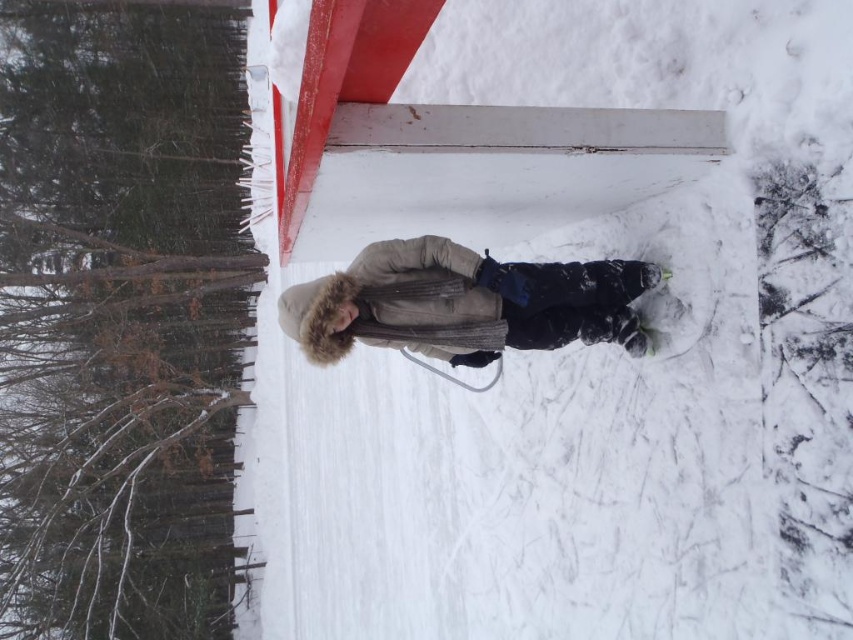
You are standing at point (463, 268) and want to walk to point (440, 72). Based on the scene description, which direction should you face to move towards your destination?

Point (440, 72) is behind point (463, 268), so you should face backwards to move towards your destination.